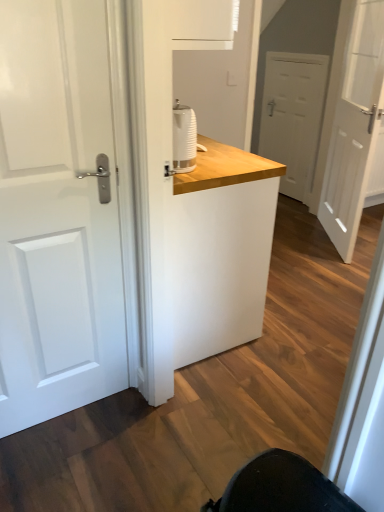
Locate an element on the screen. unoccupied region to the right of white wood counter at center is located at coordinates (295, 313).